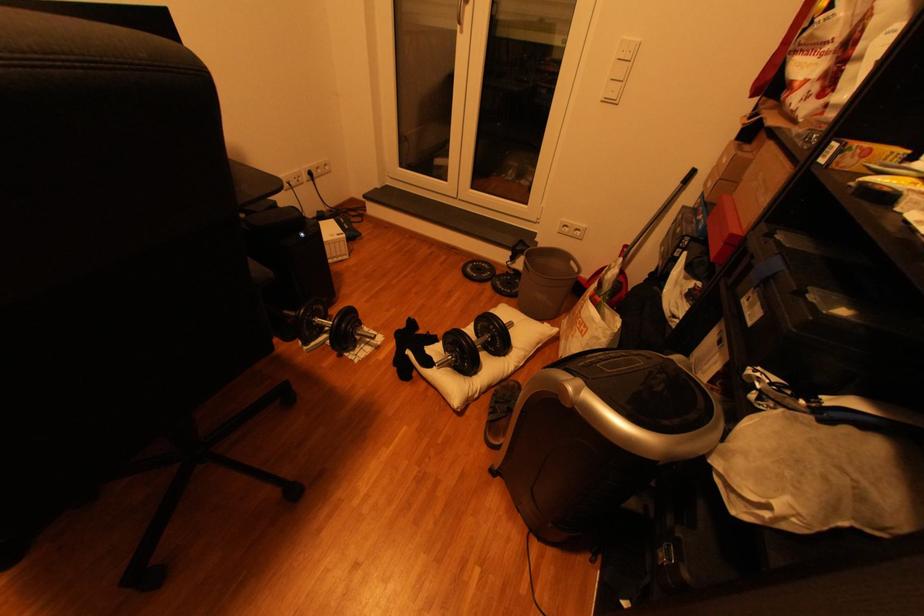
Image resolution: width=924 pixels, height=616 pixels. I want to click on brown sandal, so click(x=500, y=411).